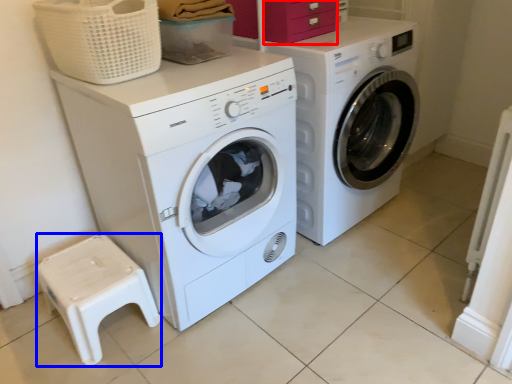
Question: Which of the following is the closest to the observer, drawer (highlighted by a red box) or step stool (highlighted by a blue box)?

Choices:
 (A) drawer
 (B) step stool

Answer: (B)